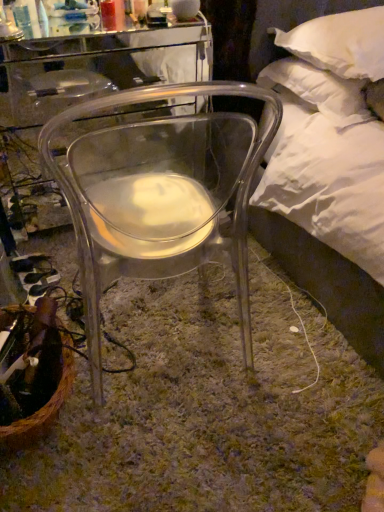
Question: Considering the positions of point (168, 125) and point (317, 76), is point (168, 125) closer or farther from the camera than point (317, 76)?

Choices:
 (A) closer
 (B) farther

Answer: (B)

Question: In the image, is transparent plastic chair at center positioned in front of or behind white soft pillow at upper right, marked as the second pillow in a top-to-bottom arrangement?

Choices:
 (A) behind
 (B) front

Answer: (B)

Question: Which object is positioned closest to the white soft pillow at upper right, marked as the second pillow in a top-to-bottom arrangement?

Choices:
 (A) white soft pillow at upper right, the first pillow positioned from the top
 (B) brown woven basket at lower left
 (C) transparent plastic chair at center

Answer: (A)

Question: Considering the real-world distances, which object is closest to the brown woven basket at lower left?

Choices:
 (A) white soft pillow at upper right, which is the first pillow in bottom-to-top order
 (B) transparent plastic chair at center
 (C) white soft pillow at upper right, arranged as the second pillow when ordered from the bottom

Answer: (B)